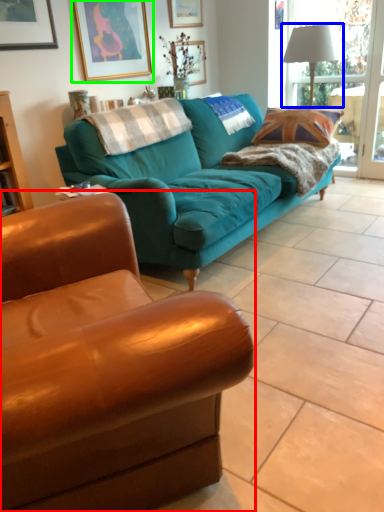
Question: Which is farther away from studio couch (highlighted by a red box)? lamp (highlighted by a blue box) or picture frame (highlighted by a green box)?

Choices:
 (A) lamp
 (B) picture frame

Answer: (A)